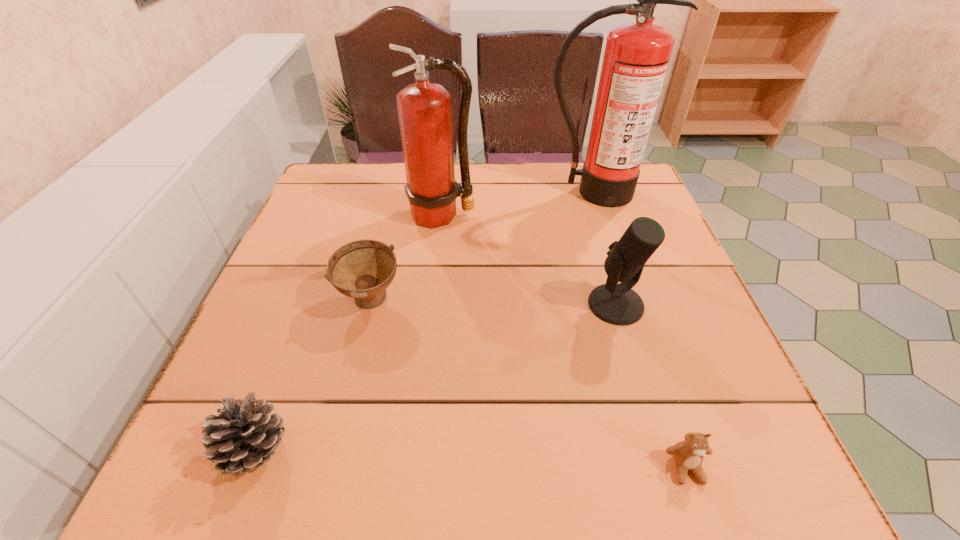
This screenshot has height=540, width=960. In order to click on the taller fire extinguisher in this screenshot , I will do `click(636, 57)`.

Where is `the tallest object`? The width and height of the screenshot is (960, 540). the tallest object is located at coordinates (636, 57).

Find the location of `the left fire extinguisher`. the left fire extinguisher is located at coordinates (x=425, y=110).

Locate an element on the screen. Image resolution: width=960 pixels, height=540 pixels. the second tallest object is located at coordinates (425, 110).

Image resolution: width=960 pixels, height=540 pixels. What are the coordinates of `microphone` in the screenshot? It's located at (617, 304).

Identify the location of soup bowl. The height and width of the screenshot is (540, 960). (363, 269).

The width and height of the screenshot is (960, 540). In order to click on pinecone in this screenshot , I will do `click(243, 436)`.

I want to click on the shortest object, so click(688, 455).

You are a GUI agent. You are given a task and a screenshot of the screen. Output one action in this format:
    pyautogui.click(x=<x>, y=<y>)
    Task: Click on the vacant space positioned 0.300m on the front-facing side of the tallest object
    This screenshot has width=960, height=540.
    Given the screenshot: What is the action you would take?
    pyautogui.click(x=626, y=292)

Where is `vacant space located at the nozzle of the second tallest object`? This screenshot has height=540, width=960. vacant space located at the nozzle of the second tallest object is located at coordinates (435, 281).